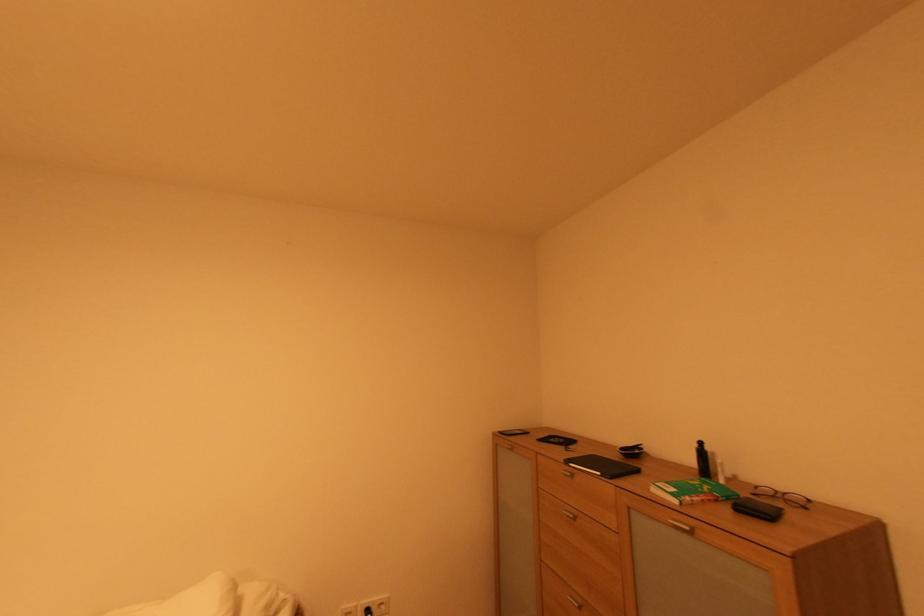
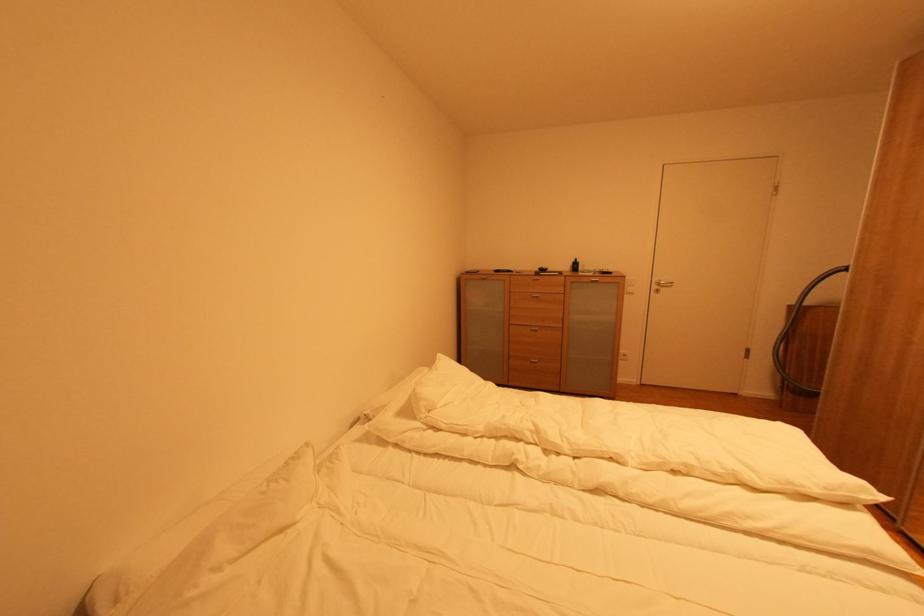
The point at (580, 519) is marked in the first image. Where is the corresponding point in the second image?

(542, 298)